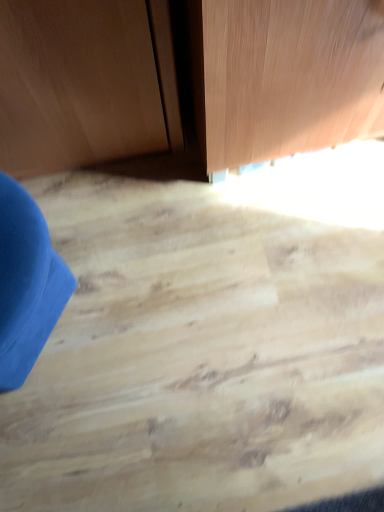
The height and width of the screenshot is (512, 384). What are the coordinates of `free space in front of natural wood door at upper center` in the screenshot? It's located at (279, 275).